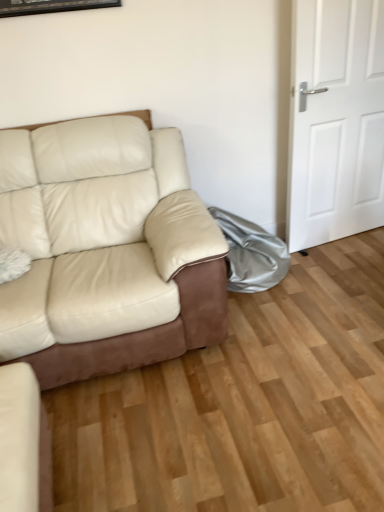
The width and height of the screenshot is (384, 512). I want to click on blank area beneath white matte door at right (from a real-world perspective), so click(337, 240).